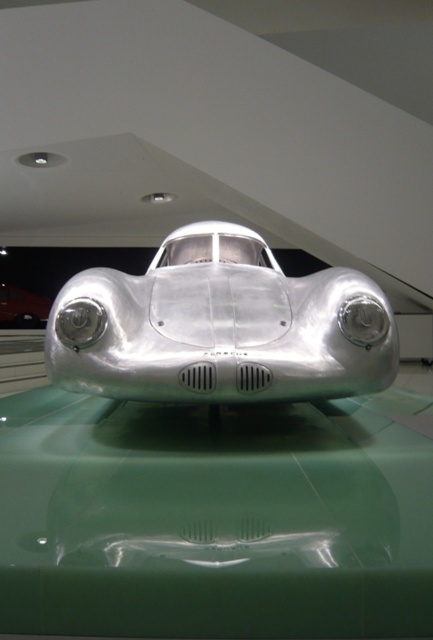
Question: Among these points, which one is farthest from the camera?

Choices:
 (A) (252, 310)
 (B) (42, 298)

Answer: (B)

Question: Can you confirm if silver metallic car at center is positioned to the right of polished silver car at center?

Choices:
 (A) no
 (B) yes

Answer: (B)

Question: Which of the following is the farthest from the observer?

Choices:
 (A) polished silver car at center
 (B) silver metallic car at center

Answer: (A)

Question: Can you confirm if silver metallic car at center is positioned above polished silver car at center?

Choices:
 (A) yes
 (B) no

Answer: (B)

Question: Does silver metallic car at center appear under polished silver car at center?

Choices:
 (A) no
 (B) yes

Answer: (B)